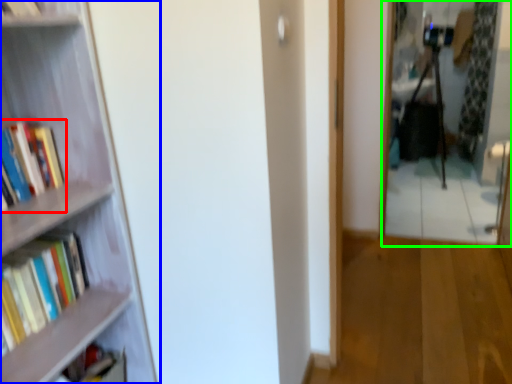
Question: Estimate the real-world distances between objects in this image. Which object is closer to book (highlighted by a red box), bookcase (highlighted by a blue box) or mirror (highlighted by a green box)?

Choices:
 (A) bookcase
 (B) mirror

Answer: (A)